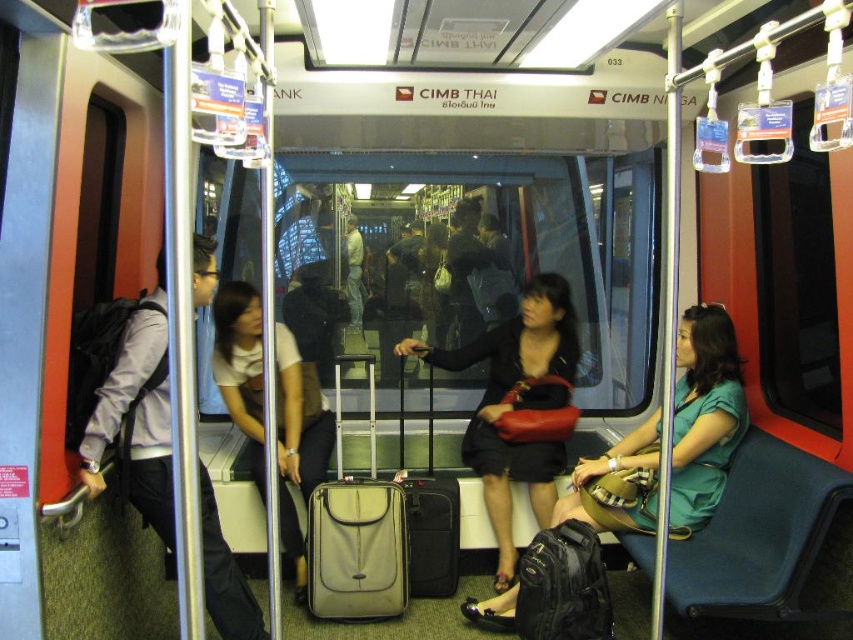
You are a passenger on the train and need to retrieve your matte black handbag at center and matte black jacket at center. Which one is closer to your right hand?

The matte black handbag at center is to the right of the matte black jacket at center, so the handbag is closer to your right hand.

You are a passenger in the train carriage and need to store your belongings. You have a matte black handbag at center and a matte black jacket at center. Which item can you place in a standard overhead compartment that requires a maximum size of 30cm in length?

The matte black handbag at center has a smaller size compared to the matte black jacket at center, so it is more likely to fit in the standard overhead compartment with a 30cm maximum length requirement.

You are a passenger on the train and want to place your new matte black backpack at left next to the matte gray suitcase at center. Can you move it there without moving the suitcase?

The matte black backpack at left is already positioned to the left of the matte gray suitcase at center, so you can move it to the right side of the suitcase without needing to move the suitcase.